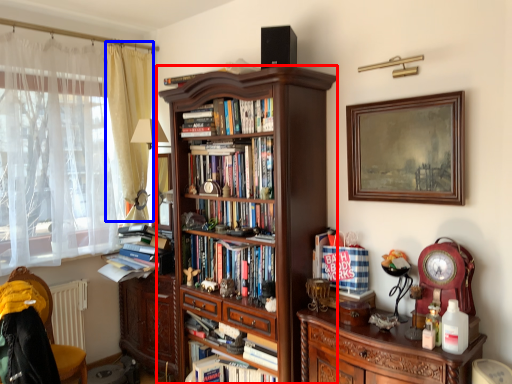
Question: Which point is further to the camera, bookcase (highlighted by a red box) or curtain (highlighted by a blue box)?

Choices:
 (A) bookcase
 (B) curtain

Answer: (B)